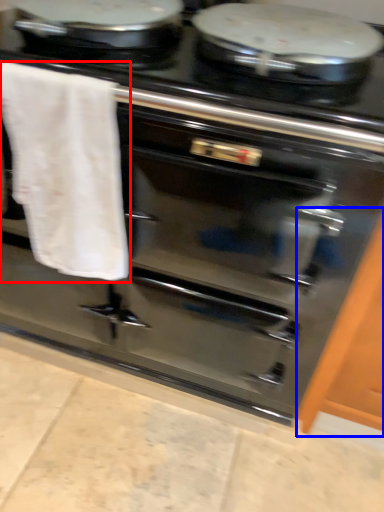
Question: Which object is closer to the camera taking this photo, bath towel (highlighted by a red box) or cabinetry (highlighted by a blue box)?

Choices:
 (A) bath towel
 (B) cabinetry

Answer: (A)